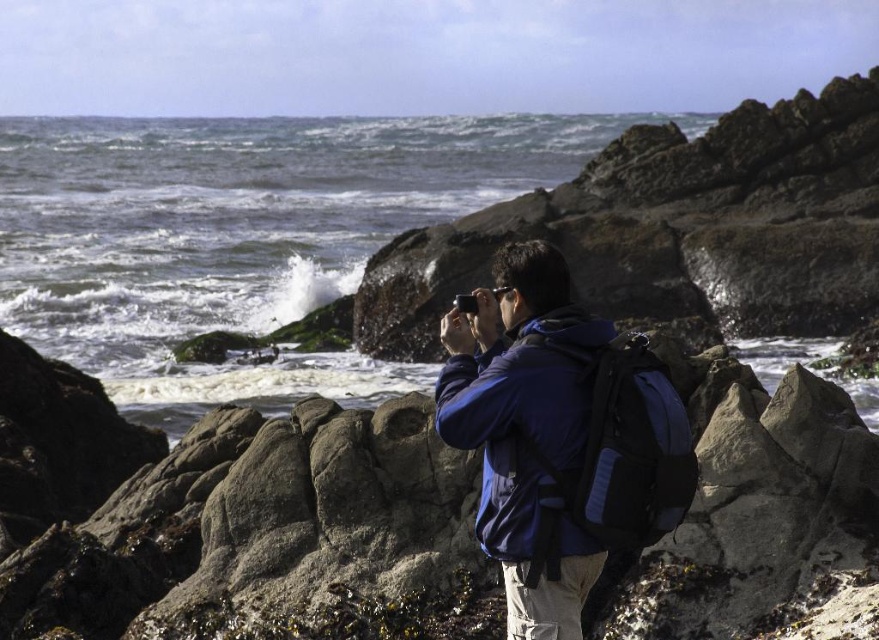
Is rough stone rocks at center bigger than blue fabric backpack at center?

Indeed, rough stone rocks at center has a larger size compared to blue fabric backpack at center.

The image size is (879, 640). Describe the element at coordinates (231, 516) in the screenshot. I see `rough stone rocks at center` at that location.

Measure the distance between point [114,442] and camera.

26.21 meters

This screenshot has width=879, height=640. I want to click on rough stone rocks at center, so click(231, 516).

Is point (461, 454) farther from viewer compared to point (576, 172)?

That is False.

Who is lower down, rough stone rocks at center or clear water at center?

rough stone rocks at center

Is point (289, 524) farther from camera compared to point (179, 129)?

That is False.

Find the location of a particular element. This screenshot has width=879, height=640. rough stone rocks at center is located at coordinates (231, 516).

Is point (151, 209) positioned after point (532, 269)?

Yes, it is behind point (532, 269).

Who is taller, clear water at center or blue fabric backpack at center?

clear water at center is taller.

Where is `clear water at center`? This screenshot has height=640, width=879. clear water at center is located at coordinates (242, 236).